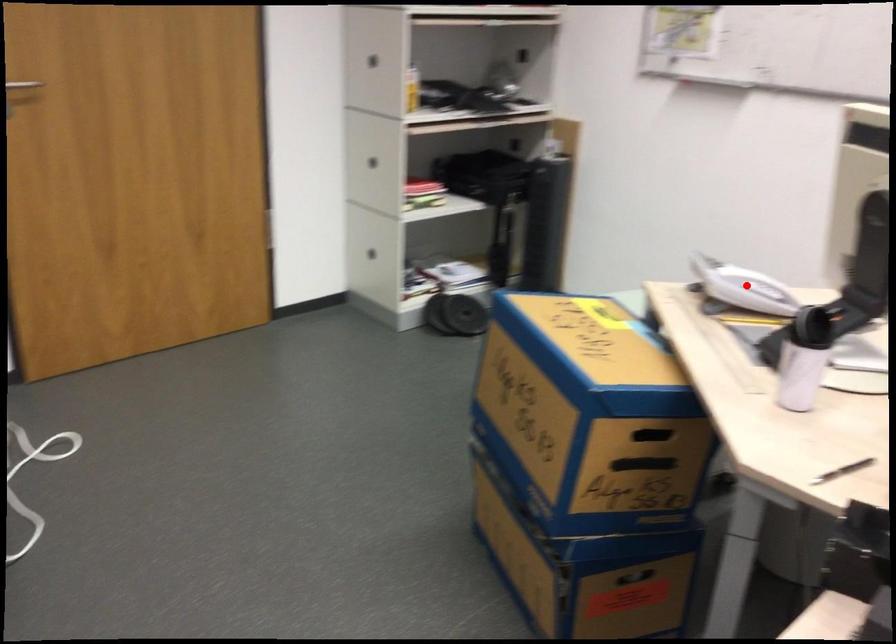
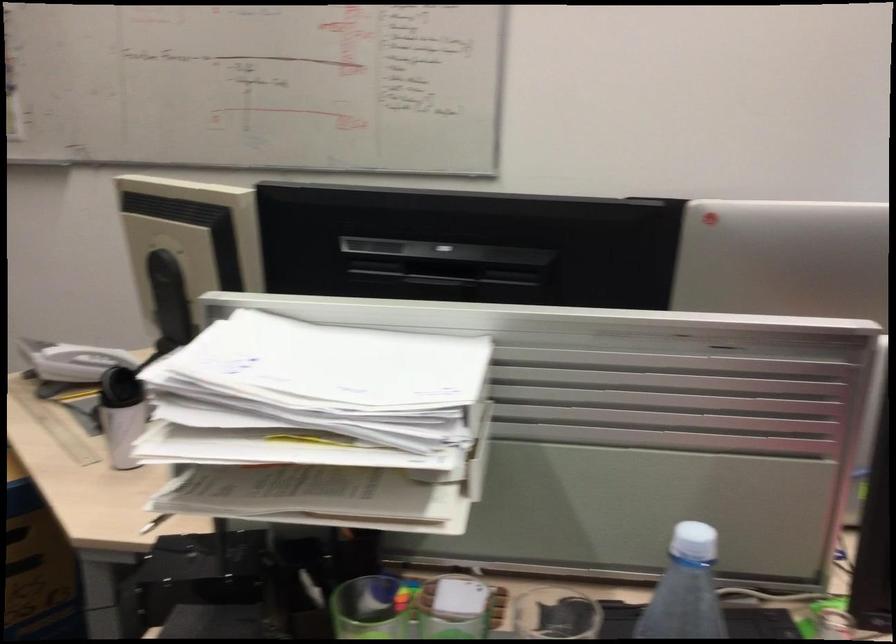
The point at the highlighted location is marked in the first image. Where is the corresponding point in the second image?

(82, 362)